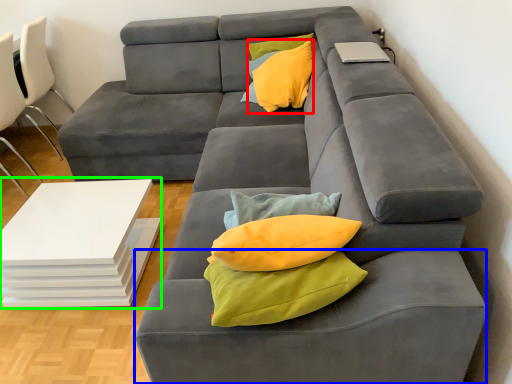
Question: Based on their relative distances, which object is nearer to throw pillow (highlighted by a red box)? Choose from footrest (highlighted by a blue box) and table (highlighted by a green box).

Choices:
 (A) footrest
 (B) table

Answer: (B)